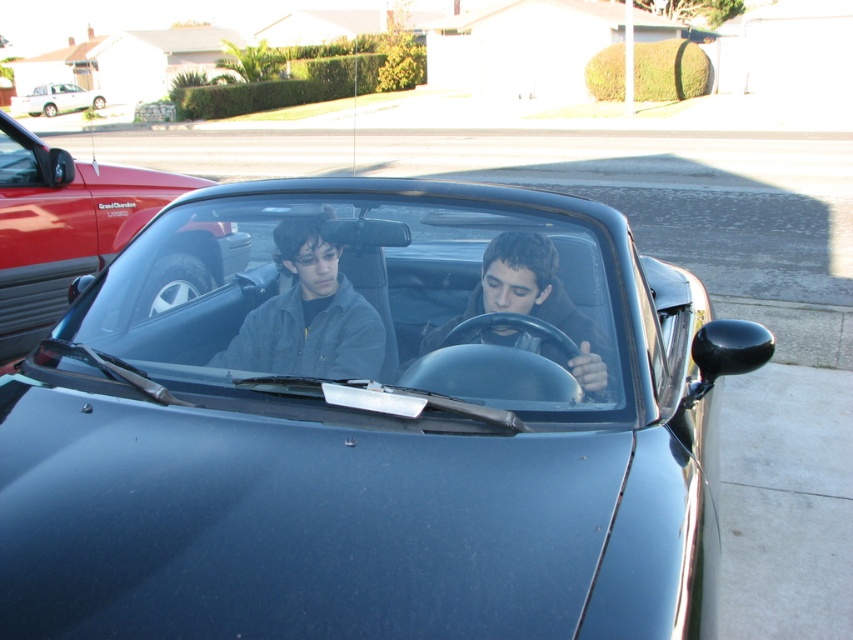
Between point (183, 291) and point (93, 99), which one is positioned behind?

Point (93, 99)

Consider the image. Which is more to the right, transparent glass windshield at center or white matte sedan at upper left?

transparent glass windshield at center

Where is `transparent glass windshield at center`? transparent glass windshield at center is located at coordinates (364, 296).

Who is lower down, dark gray jacket at center or white matte sedan at upper left?

dark gray jacket at center

Identify the location of dark gray jacket at center. (309, 314).

Can you confirm if dark brown leather jacket at center is positioned below white matte sedan at upper left?

Indeed, dark brown leather jacket at center is positioned under white matte sedan at upper left.

Between dark brown leather jacket at center and white matte sedan at upper left, which one is positioned lower?

dark brown leather jacket at center

Who is more forward, (527,282) or (15,109)?

Point (527,282)

Locate an element on the screen. Image resolution: width=853 pixels, height=640 pixels. dark brown leather jacket at center is located at coordinates (532, 307).